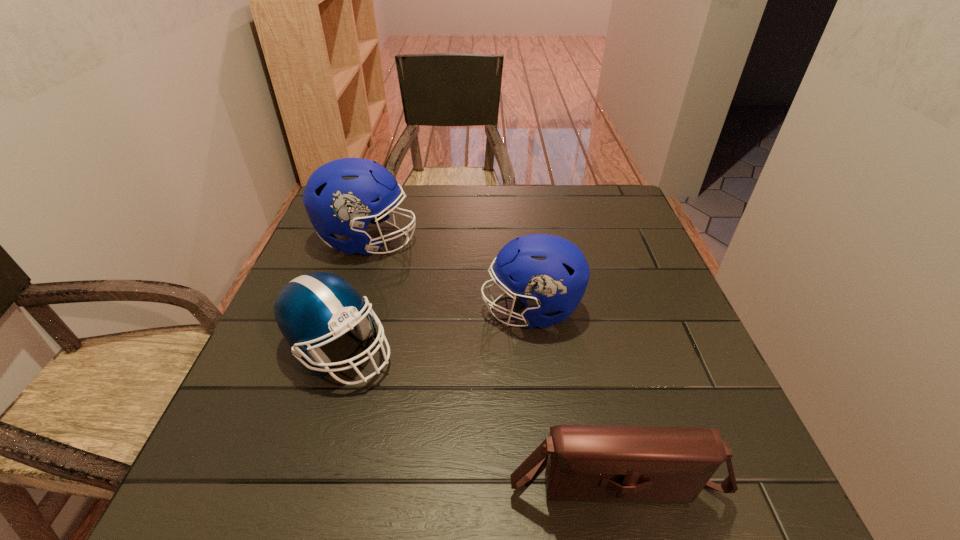
Locate which object ranks second in proximity to the shoulder bag. Please provide its 2D coordinates. Your answer should be formatted as a tuple, i.e. [(x, y)], where the tuple contains the x and y coordinates of a point satisfying the conditions above.

[(310, 309)]

Find the location of `object that is the third closest one to the farthest object`. object that is the third closest one to the farthest object is located at coordinates (641, 464).

You are a GUI agent. You are given a task and a screenshot of the screen. Output one action in this format:
    pyautogui.click(x=<x>, y=<y>)
    Task: Click on the football helmet that is the second closest to the nearest object
    The height and width of the screenshot is (540, 960).
    Given the screenshot: What is the action you would take?
    pyautogui.click(x=310, y=309)

Image resolution: width=960 pixels, height=540 pixels. Identify the location of the second closest football helmet relative to the nearest object. (310, 309).